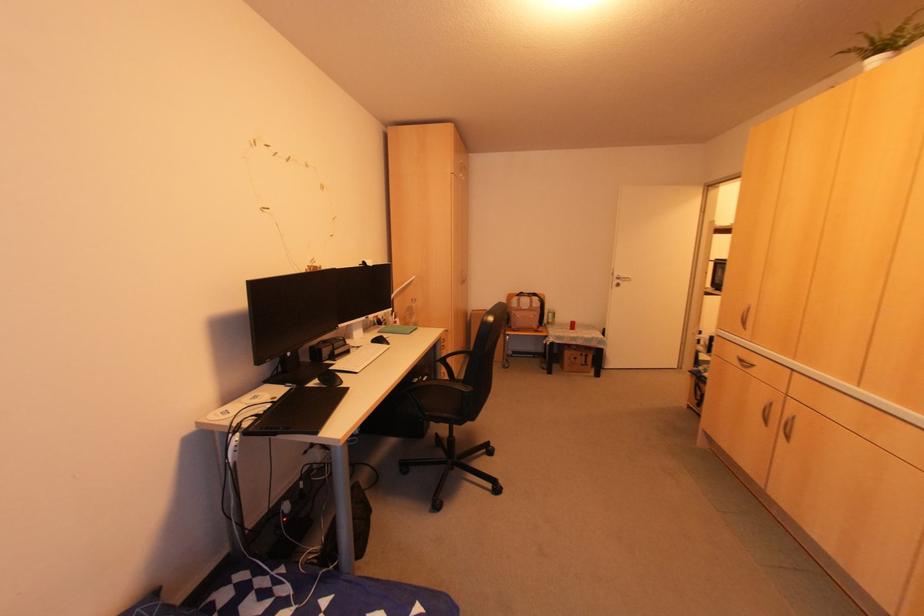
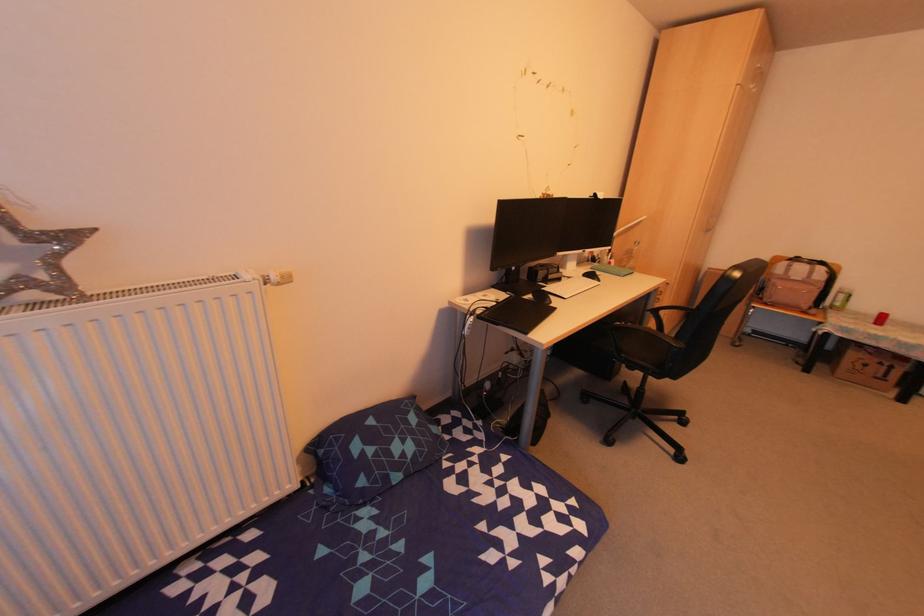
Question: Based on the continuous images, in which direction is the camera rotating? Reply with the corresponding letter.

Choices:
 (A) Left
 (B) Right
 (C) Up
 (D) Down

Answer: (A)